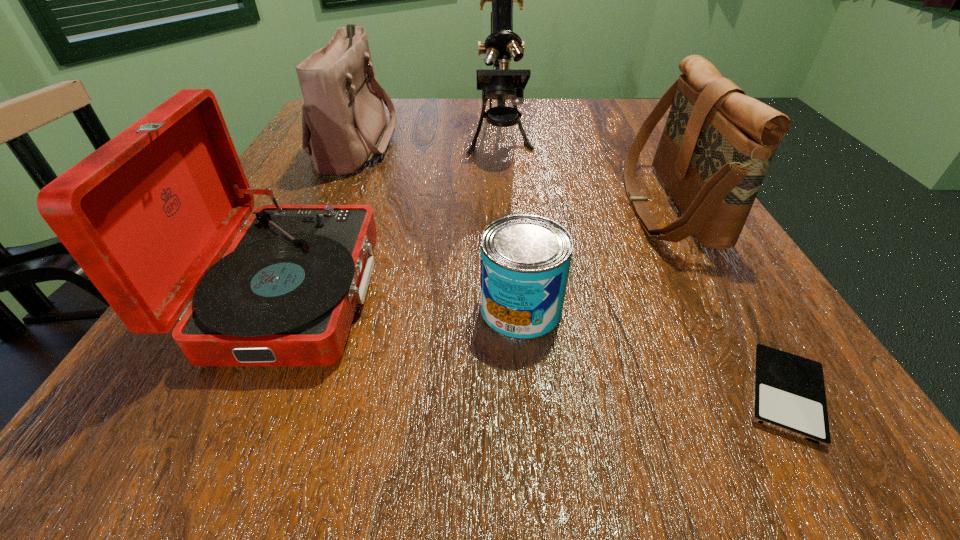
Image resolution: width=960 pixels, height=540 pixels. Find the location of `free space that satisfies the following two spatial constraints: 1. through the eyepiece of the tallest object; 2. on the right side of the shortest object`. free space that satisfies the following two spatial constraints: 1. through the eyepiece of the tallest object; 2. on the right side of the shortest object is located at coordinates (518, 394).

This screenshot has height=540, width=960. Identify the location of vacant space that satisfies the following two spatial constraints: 1. through the eyepiece of the microscope; 2. on the left side of the iPod. (518, 394).

Locate an element on the screen. This screenshot has height=540, width=960. blank area in the image that satisfies the following two spatial constraints: 1. on the front-facing side of the right shoulder bag; 2. on the front side of the can is located at coordinates (727, 309).

Find the location of `free spot that satisfies the following two spatial constraints: 1. on the front-facing side of the right shoulder bag; 2. on the front side of the fifth tallest object`. free spot that satisfies the following two spatial constraints: 1. on the front-facing side of the right shoulder bag; 2. on the front side of the fifth tallest object is located at coordinates (727, 309).

This screenshot has height=540, width=960. In order to click on free space that satisfies the following two spatial constraints: 1. on the front-facing side of the right shoulder bag; 2. on the front side of the fifth tallest object in this screenshot , I will do point(727,309).

Identify the location of free location that satisfies the following two spatial constraints: 1. on the back side of the shortest object; 2. on the front pocket of the left shoulder bag. The image size is (960, 540). (636, 142).